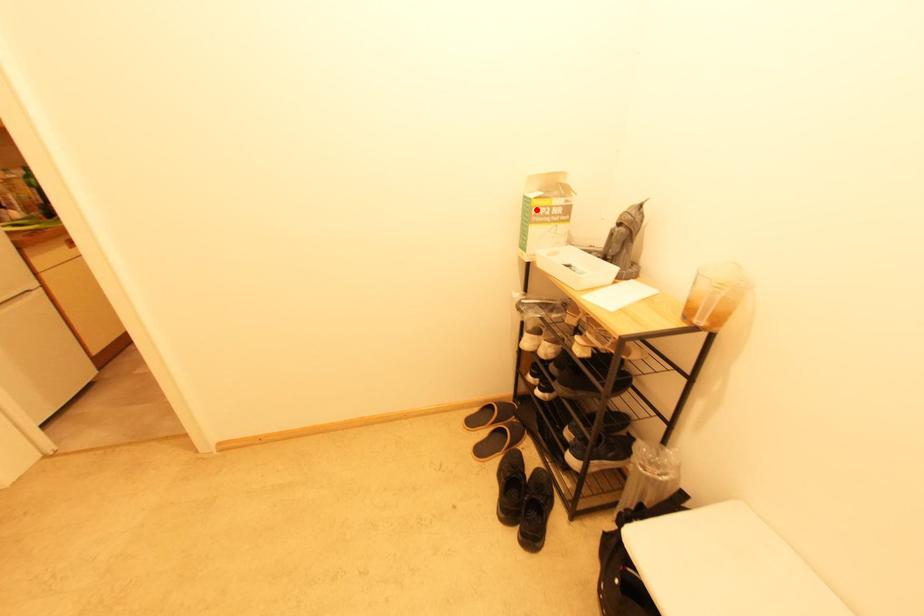
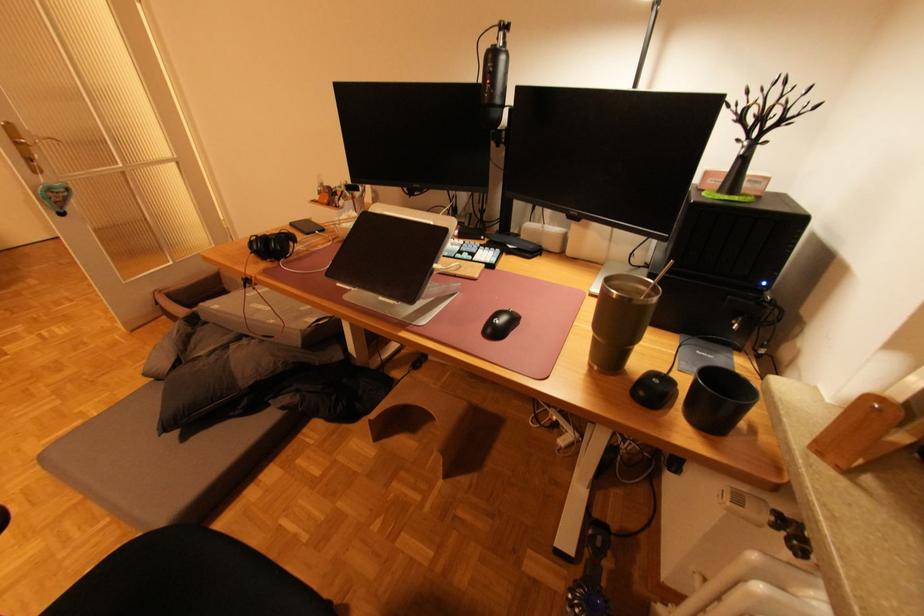
Question: I am providing you with two images of the same scene from different viewpoints. A red point is marked on the first image. At the location where the point appears in image 1, is it still visible in image 2?

Choices:
 (A) Yes
 (B) No

Answer: (B)